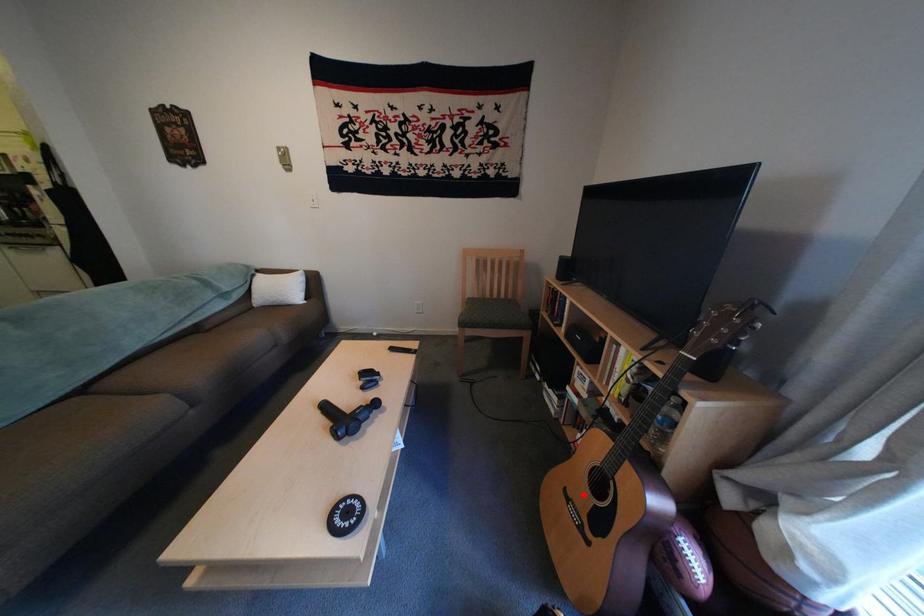
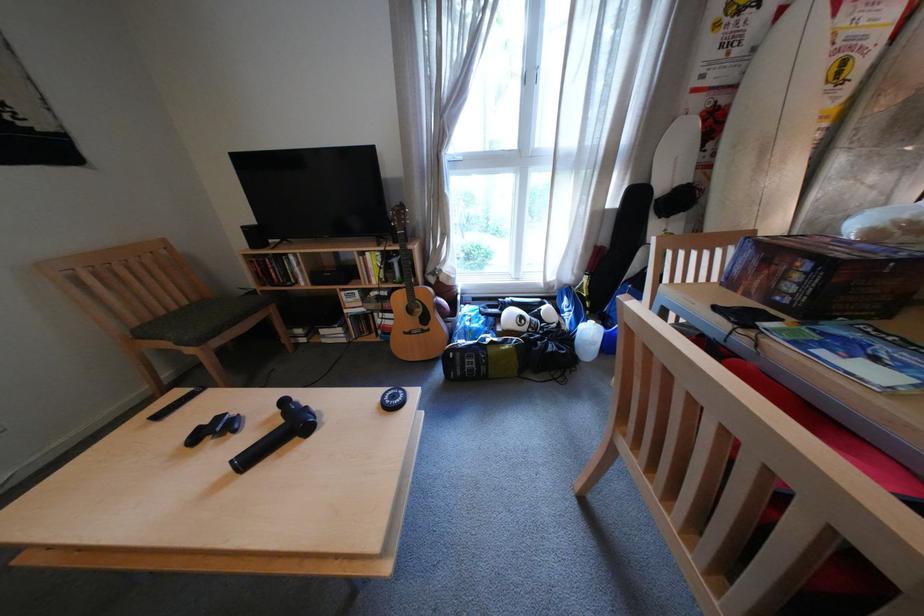
Question: I am providing you with two images of the same scene from different viewpoints. Image1 has a red point marked. In image2, the corresponding 3D location appears at what relative position? Reply with the corresponding letter.

Choices:
 (A) Closer
 (B) Farther

Answer: (B)